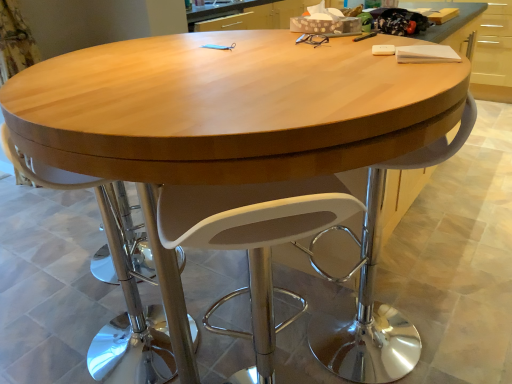
Find the location of a particular element. vacant point to the right of white plastic chair at center is located at coordinates (232, 332).